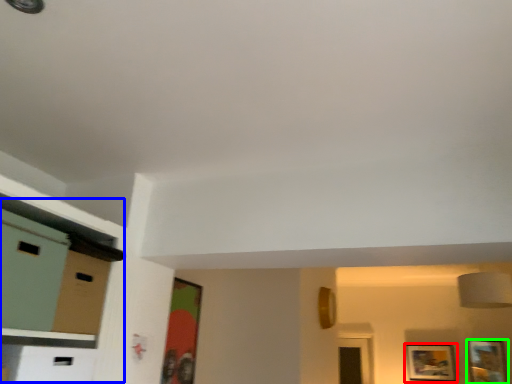
Question: Which is nearer to the picture frame (highlighted by a red box)? dresser (highlighted by a blue box) or picture frame (highlighted by a green box).

Choices:
 (A) dresser
 (B) picture frame

Answer: (B)